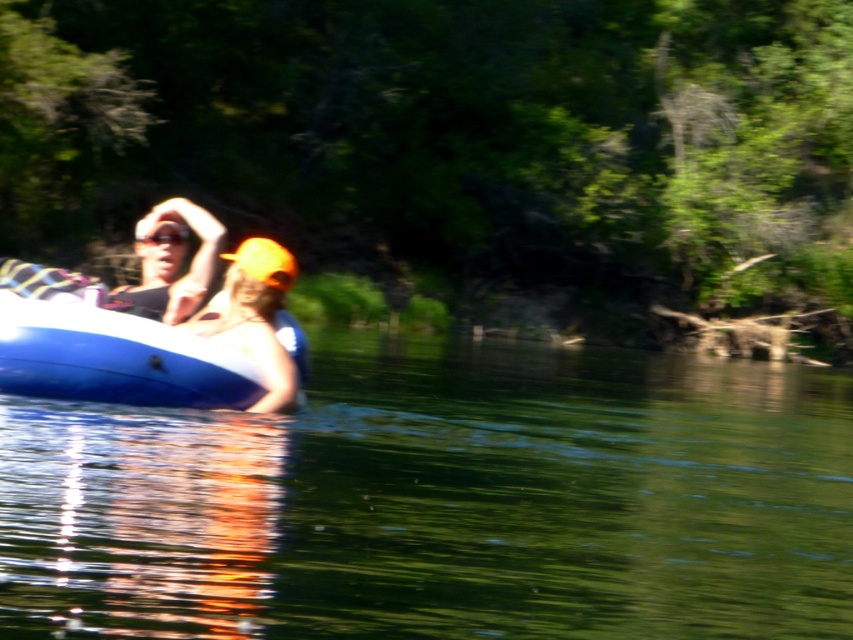
Which is more to the left, blue rubber boat at left or orange fabric cap at center?

blue rubber boat at left

The image size is (853, 640). Find the location of `blue rubber boat at left`. blue rubber boat at left is located at coordinates (106, 348).

Is green smooth water at center positioned at the back of matte orange cap at left?

No, green smooth water at center is closer to the viewer.

Is point (103, 472) positioned after point (143, 220)?

No, (103, 472) is closer to viewer.

Identify the location of green smooth water at center. (440, 500).

Who is more forward, (119, 326) or (178, 198)?

Point (119, 326) is more forward.

Which of these two, blue rubber boat at left or matte orange cap at left, stands taller?

matte orange cap at left is taller.

Between point (90, 385) and point (163, 298), which one is positioned behind?

Point (163, 298)

Locate an element on the screen. This screenshot has width=853, height=640. blue rubber boat at left is located at coordinates (106, 348).